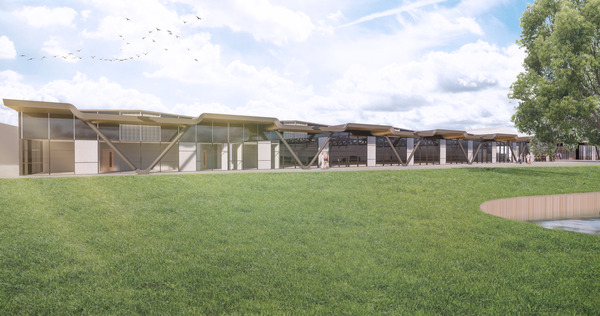
The width and height of the screenshot is (600, 316). In order to click on door in this screenshot , I will do `click(105, 157)`, `click(203, 160)`.